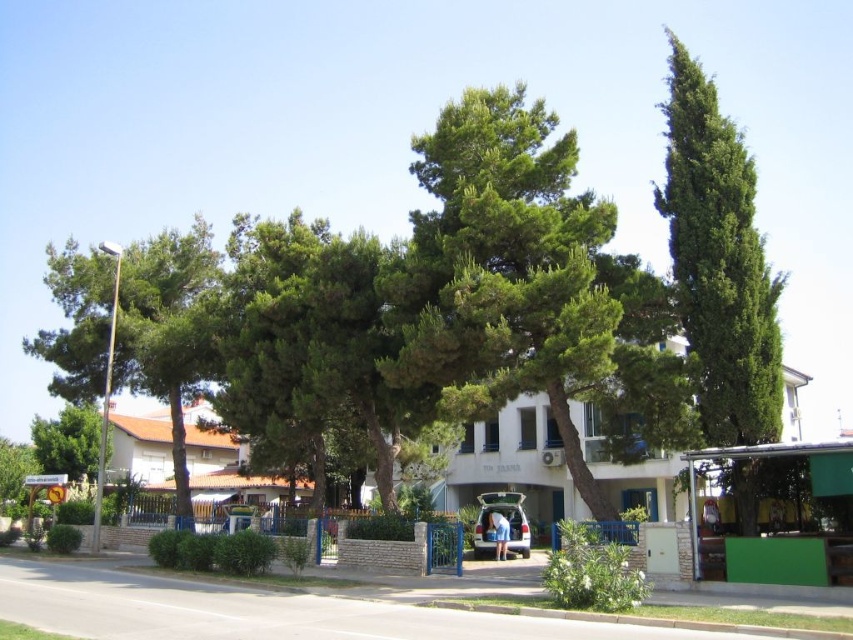
Does green leafy tree at left appear over green leafy tree at lower left?

Correct, green leafy tree at left is located above green leafy tree at lower left.

Does green leafy tree at left appear on the right side of green leafy tree at lower left?

Indeed, green leafy tree at left is positioned on the right side of green leafy tree at lower left.

Which is in front, point (134, 392) or point (90, 419)?

Point (134, 392)

Locate an element on the screen. green leafy tree at left is located at coordinates (167, 330).

Can you confirm if green coniferous tree at right is wider than green leafy tree at lower left?

In fact, green coniferous tree at right might be narrower than green leafy tree at lower left.

What are the coordinates of `green coniferous tree at right` in the screenshot? It's located at (718, 260).

Is green coniferous tree at right positioned behind green leafy tree at left?

No, it is in front of green leafy tree at left.

Which of these two, green coniferous tree at right or green leafy tree at left, stands taller?

Standing taller between the two is green coniferous tree at right.

The image size is (853, 640). What do you see at coordinates (718, 260) in the screenshot?
I see `green coniferous tree at right` at bounding box center [718, 260].

You are a GUI agent. You are given a task and a screenshot of the screen. Output one action in this format:
    pyautogui.click(x=<x>, y=<y>)
    Task: Click on the green coniferous tree at right
    
    Given the screenshot: What is the action you would take?
    pyautogui.click(x=718, y=260)